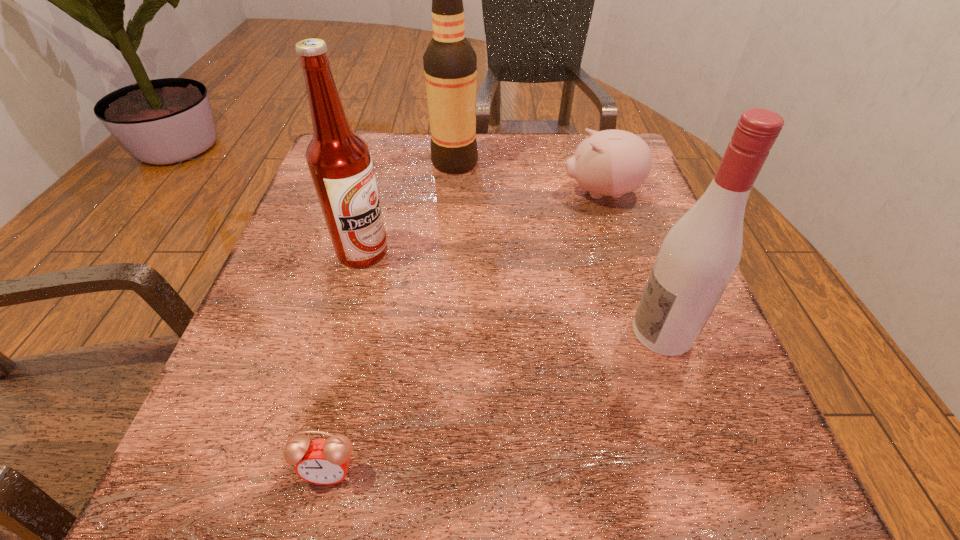
Find the location of a particular element. object that is at the near edge is located at coordinates (322, 461).

What are the coordinates of `alcohol situated at the left edge` in the screenshot? It's located at (339, 161).

Image resolution: width=960 pixels, height=540 pixels. What are the coordinates of `alarm clock at the left edge` in the screenshot? It's located at (322, 461).

Where is `alcohol at the right edge`? This screenshot has height=540, width=960. alcohol at the right edge is located at coordinates click(x=699, y=255).

This screenshot has height=540, width=960. I want to click on piggy bank present at the right edge, so (612, 162).

Where is `object positioned at the near left corner`? Image resolution: width=960 pixels, height=540 pixels. object positioned at the near left corner is located at coordinates (322, 461).

This screenshot has height=540, width=960. Identify the location of object located in the far right corner section of the desktop. (612, 162).

The width and height of the screenshot is (960, 540). In the image, there is a desktop. In order to click on vacant space at the far edge in this screenshot , I will do `click(513, 178)`.

In the image, there is a desktop. What are the coordinates of `vacant area at the near edge` in the screenshot? It's located at (468, 451).

Locate an element on the screen. This screenshot has width=960, height=540. vacant space at the left edge is located at coordinates (267, 367).